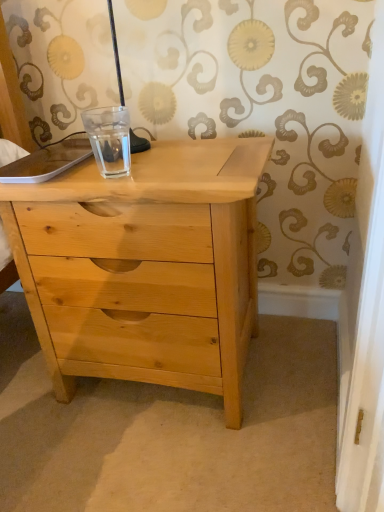
Question: Relative to clear glass cup at center, is natural wood chest of drawers at center in front or behind?

Choices:
 (A) front
 (B) behind

Answer: (A)

Question: Considering the positions of natural wood chest of drawers at center and clear glass cup at center in the image, is natural wood chest of drawers at center wider or thinner than clear glass cup at center?

Choices:
 (A) thin
 (B) wide

Answer: (B)

Question: Is point (168, 376) positioned closer to the camera than point (97, 115)?

Choices:
 (A) closer
 (B) farther

Answer: (A)

Question: Considering the positions of clear glass cup at center and natural wood chest of drawers at center in the image, is clear glass cup at center taller or shorter than natural wood chest of drawers at center?

Choices:
 (A) short
 (B) tall

Answer: (A)

Question: From a real-world perspective, is clear glass cup at center positioned above or below natural wood chest of drawers at center?

Choices:
 (A) above
 (B) below

Answer: (A)

Question: Does point (127, 113) appear closer or farther from the camera than point (210, 382)?

Choices:
 (A) closer
 (B) farther

Answer: (B)

Question: From the image's perspective, is clear glass cup at center positioned above or below natural wood chest of drawers at center?

Choices:
 (A) above
 (B) below

Answer: (A)